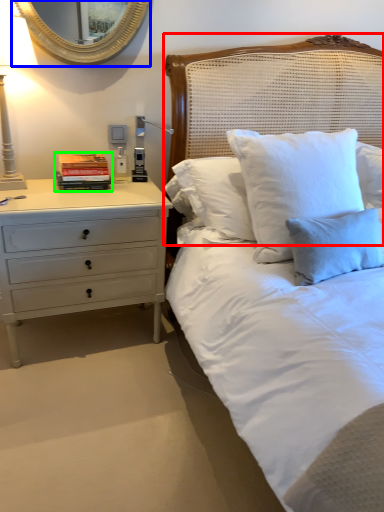
Question: Estimate the real-world distances between objects in this image. Which object is farther from headboard (highlighted by a red box), mirror (highlighted by a blue box) or book (highlighted by a green box)?

Choices:
 (A) mirror
 (B) book

Answer: (B)